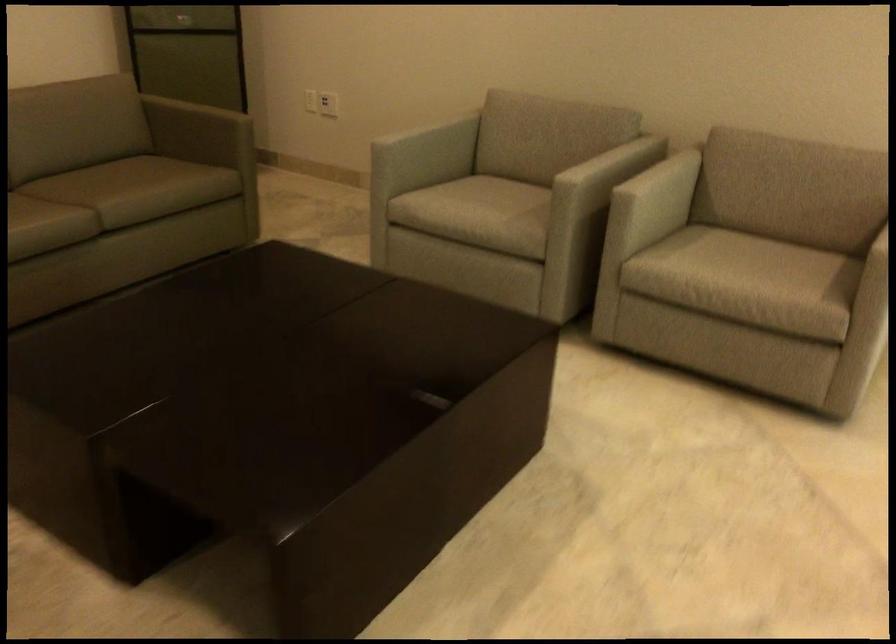
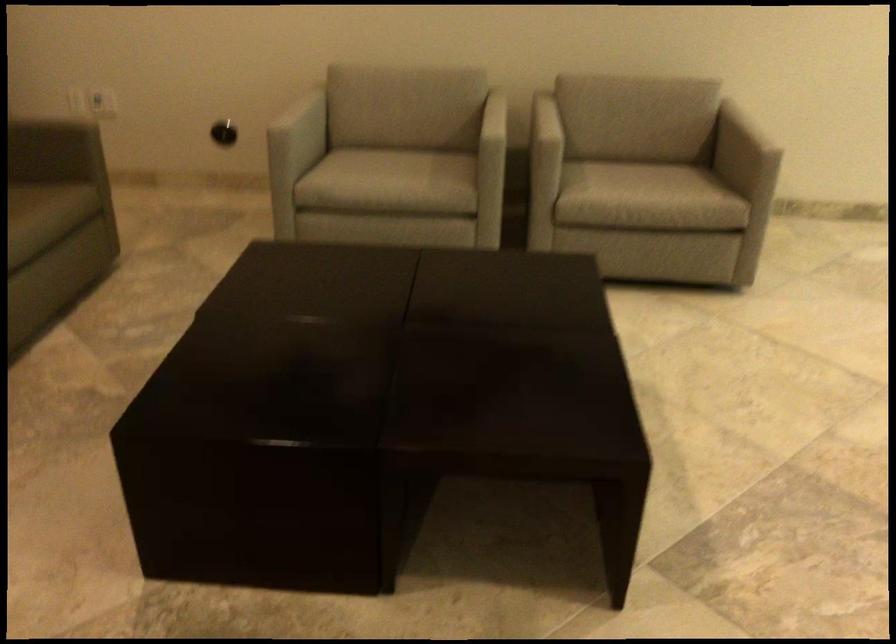
Locate, in the second image, the point that corresponds to (773,247) in the first image.

(633, 160)